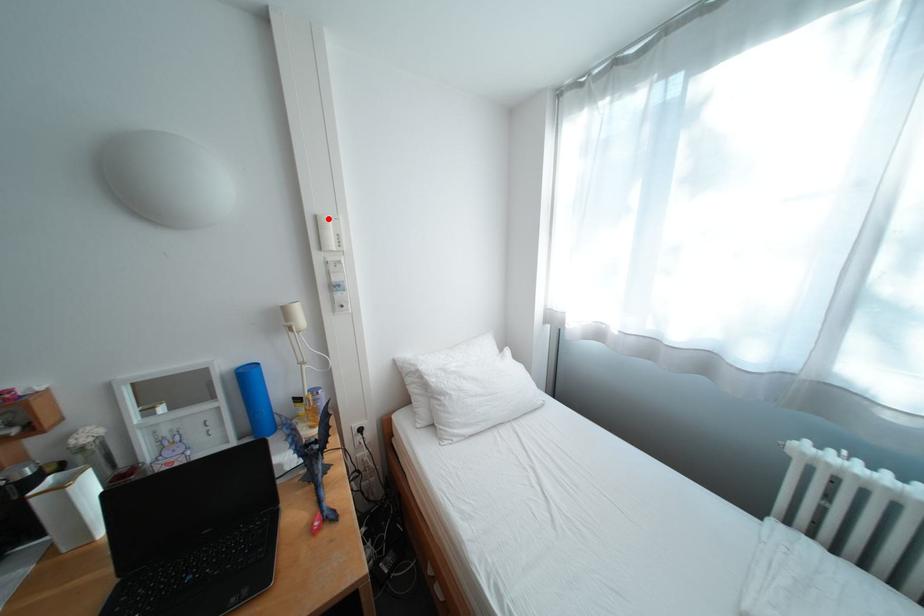
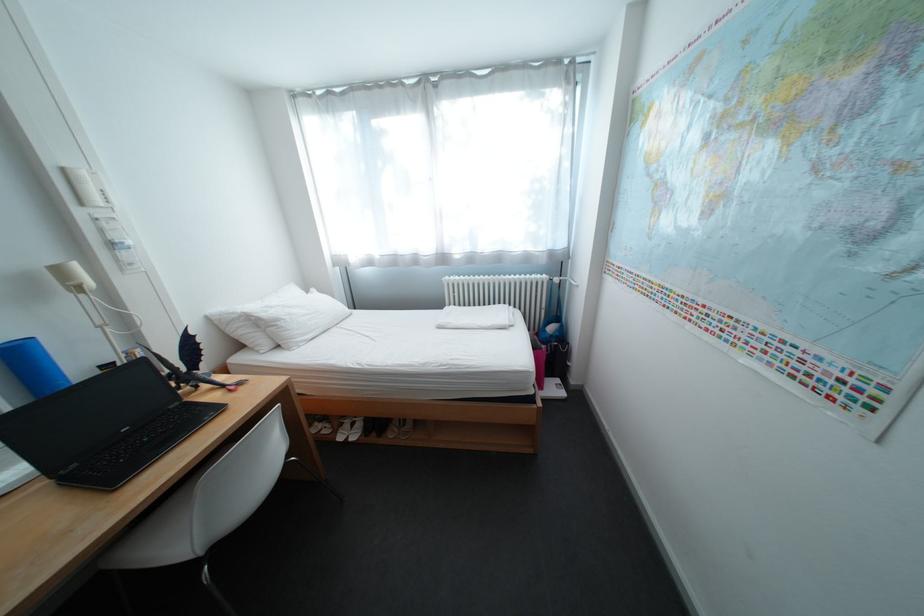
In the second image, find the point that corresponds to the highlighted location in the first image.

(76, 171)